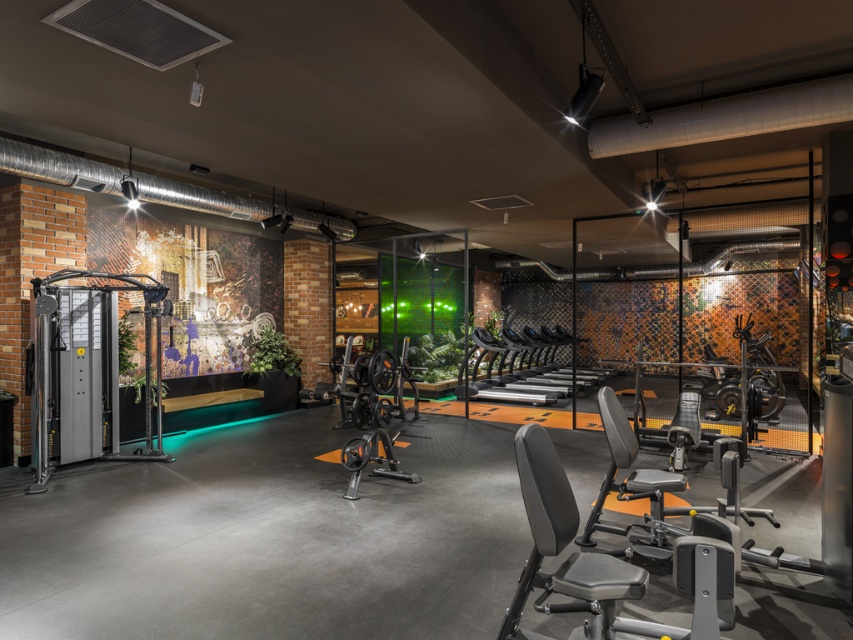
Question: Does silver metallic weight machine at left appear on the left side of black textured weight bench at center?

Choices:
 (A) no
 (B) yes

Answer: (B)

Question: Which point is farther from the camera taking this photo?

Choices:
 (A) (38, 472)
 (B) (370, 432)

Answer: (B)

Question: Is silver metallic weight machine at left thinner than black textured weight bench at center?

Choices:
 (A) no
 (B) yes

Answer: (A)

Question: Among these points, which one is farthest from the camera?

Choices:
 (A) (90, 400)
 (B) (393, 362)

Answer: (B)

Question: Does silver metallic weight machine at left have a smaller size compared to black textured weight bench at center?

Choices:
 (A) yes
 (B) no

Answer: (B)

Question: Among these points, which one is farthest from the camera?

Choices:
 (A) (97, 352)
 (B) (393, 433)

Answer: (B)